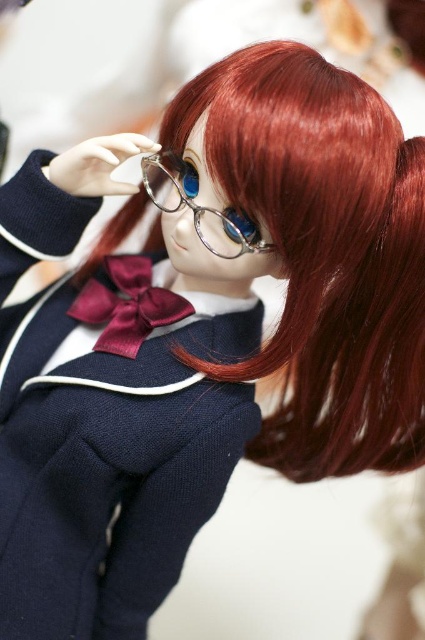
You are holding a ruler and want to measure the distance from your eye level to the point at coordinates point (116, 349) on the doll. According to the image, what is this distance?

The distance of point (116, 349) from viewer is 30.20 inches.

The doll is holding its hand near its face. Based on the scene, can the doll see through the clear plastic glasses at center while wearing the satin burgundy bow tie at center?

The clear plastic glasses at center is behind the satin burgundy bow tie at center, so the bow tie is blocking the glasses. Therefore, the doll cannot see through the clear plastic glasses at center while wearing the satin burgundy bow tie at center.